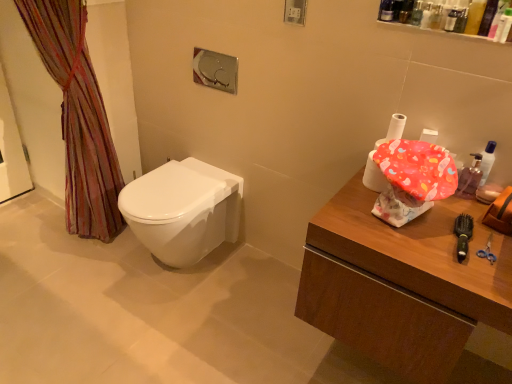
Identify the location of empty space that is in between green plastic brush at right and translucent plastic mouthwash at upper right, the 1th mouthwash when ordered from back to front. (463, 214).